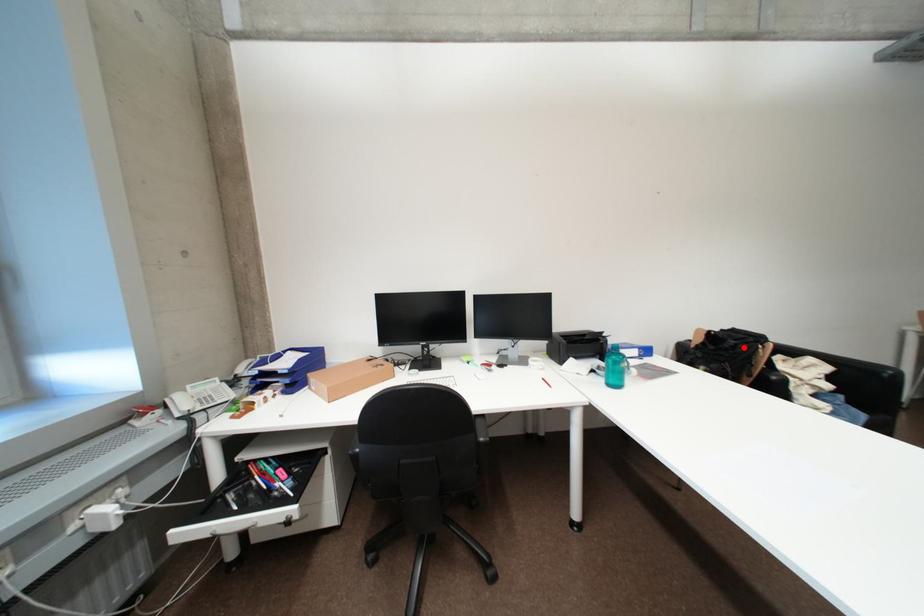
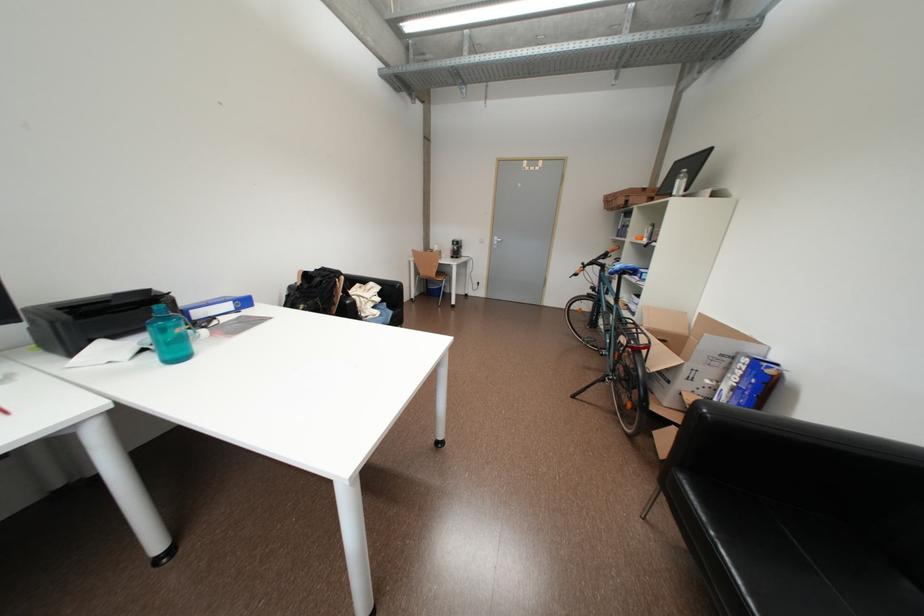
The point at the highlighted location is marked in the first image. Where is the corresponding point in the second image?

(330, 284)